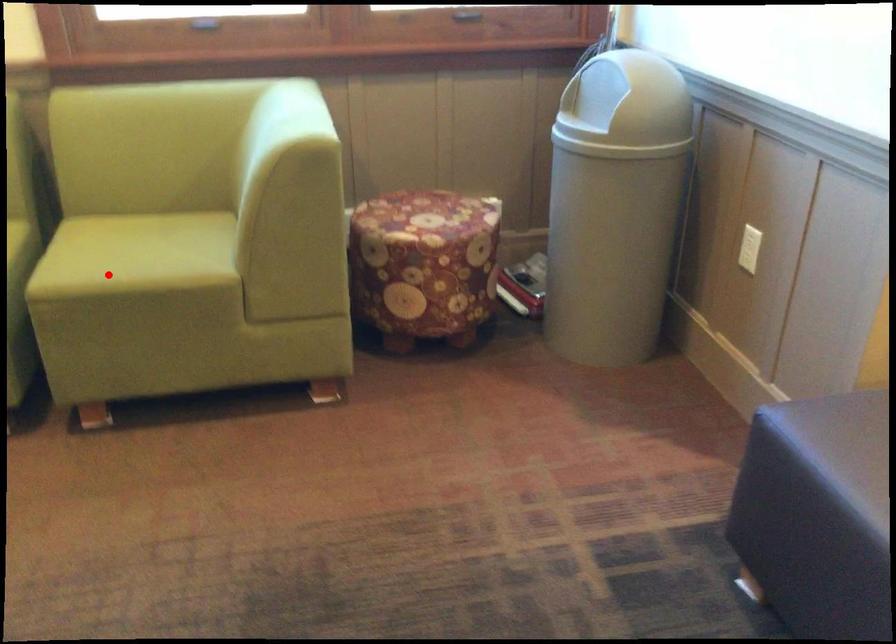
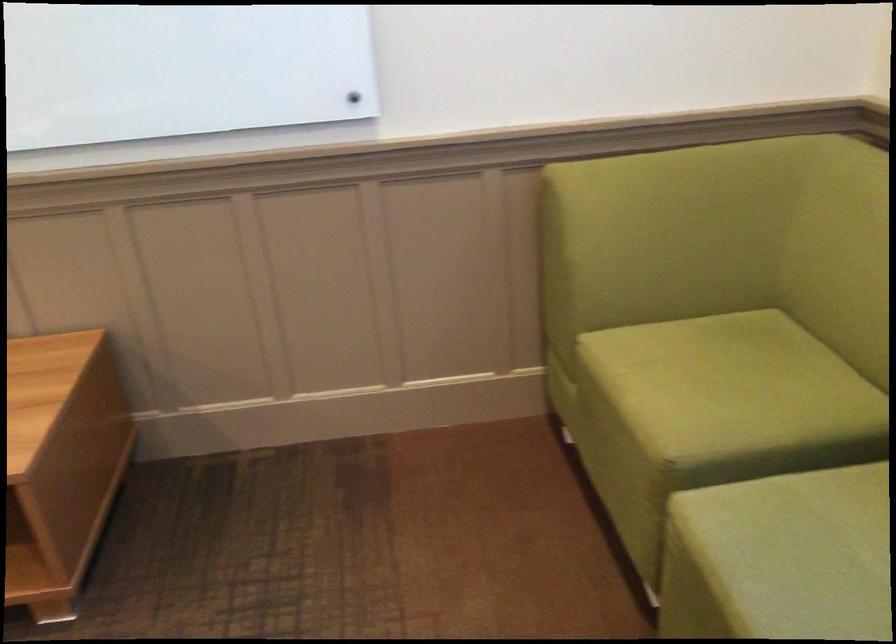
Question: I am providing you with two images of the same scene from different viewpoints. Image1 has a red point marked. In image2, the corresponding 3D location appears at what relative position? Reply with the corresponding letter.

Choices:
 (A) Closer
 (B) Farther

Answer: (A)